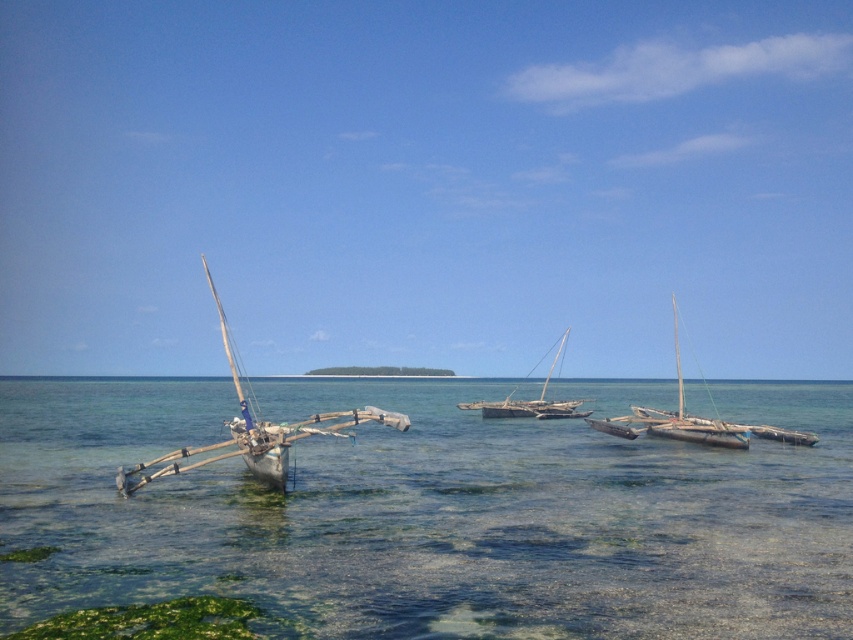
Question: Can you confirm if wooden sailboat at left is thinner than wooden sailboat at center?

Choices:
 (A) no
 (B) yes

Answer: (A)

Question: Does clear water at boat left appear on the left side of wooden sailboat at left?

Choices:
 (A) no
 (B) yes

Answer: (A)

Question: Can you confirm if wooden sailboat at left is thinner than wooden sailboat at center?

Choices:
 (A) no
 (B) yes

Answer: (A)

Question: Which object appears farthest from the camera in this image?

Choices:
 (A) wooden sailboat at center
 (B) clear water at boat left
 (C) wooden sailboat at left

Answer: (A)

Question: Which object appears farthest from the camera in this image?

Choices:
 (A) wooden sailboat at center
 (B) wooden sailboat at left
 (C) clear water at boat left

Answer: (A)

Question: Estimate the real-world distances between objects in this image. Which object is closer to the clear water at boat left?

Choices:
 (A) wooden sailboat at left
 (B) wooden sailboat at center

Answer: (B)